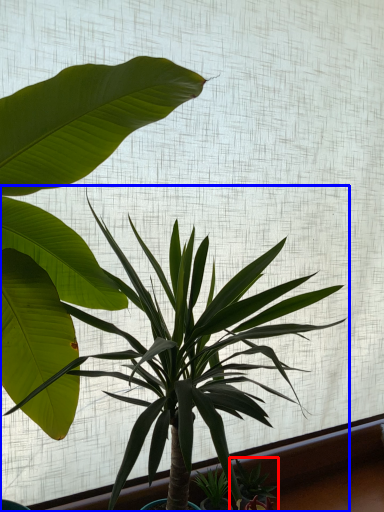
Question: Which object appears farthest to the camera in this image, houseplant (highlighted by a red box) or houseplant (highlighted by a blue box)?

Choices:
 (A) houseplant
 (B) houseplant

Answer: (A)